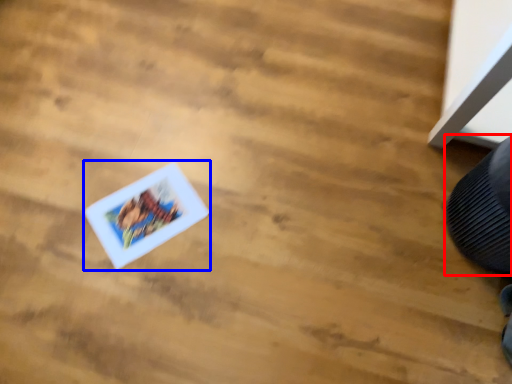
Question: Which of the following is the closest to the observer, shoe (highlighted by a red box) or comic book (highlighted by a blue box)?

Choices:
 (A) shoe
 (B) comic book

Answer: (A)